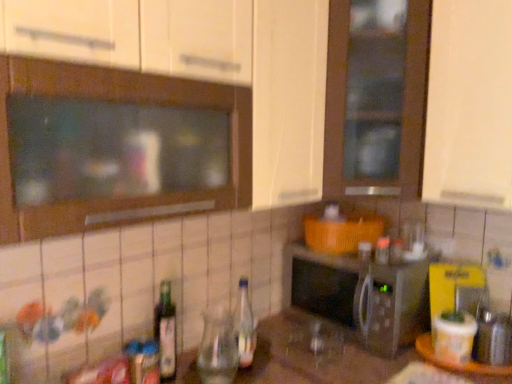
Question: Considering the relative sizes of clear glass bottle at center, the 2th bottle viewed from the left, and green glass bottle at lower left, arranged as the 1th bottle when viewed from the left, in the image provided, is clear glass bottle at center, the 2th bottle viewed from the left, taller than green glass bottle at lower left, arranged as the 1th bottle when viewed from the left,?

Choices:
 (A) yes
 (B) no

Answer: (B)

Question: Is clear glass bottle at center, the 2th bottle viewed from the left, smaller than green glass bottle at lower left, which is the second bottle from right to left?

Choices:
 (A) yes
 (B) no

Answer: (A)

Question: From a real-world perspective, does clear glass bottle at center, placed as the 1th bottle when sorted from right to left, sit lower than green glass bottle at lower left, which is the second bottle from right to left?

Choices:
 (A) no
 (B) yes

Answer: (A)

Question: Is clear glass bottle at center, placed as the 1th bottle when sorted from right to left, bigger than green glass bottle at lower left, which is the second bottle from right to left?

Choices:
 (A) no
 (B) yes

Answer: (A)

Question: Is clear glass bottle at center, placed as the 1th bottle when sorted from right to left, outside of green glass bottle at lower left, which is the second bottle from right to left?

Choices:
 (A) yes
 (B) no

Answer: (A)

Question: From a real-world perspective, is green glass bottle at lower left, which is the second bottle from right to left, positioned above or below silver metallic microwave at center?

Choices:
 (A) below
 (B) above

Answer: (B)

Question: In terms of size, does green glass bottle at lower left, arranged as the 1th bottle when viewed from the left, appear bigger or smaller than silver metallic microwave at center?

Choices:
 (A) big
 (B) small

Answer: (B)

Question: In the image, is green glass bottle at lower left, which is the second bottle from right to left, positioned in front of or behind silver metallic microwave at center?

Choices:
 (A) front
 (B) behind

Answer: (A)

Question: Visually, is green glass bottle at lower left, arranged as the 1th bottle when viewed from the left, positioned to the left or to the right of silver metallic microwave at center?

Choices:
 (A) right
 (B) left

Answer: (B)

Question: Is silver metallic microwave at center situated inside clear glass bottle at center, the 2th bottle viewed from the left, or outside?

Choices:
 (A) inside
 (B) outside

Answer: (B)

Question: In terms of width, does silver metallic microwave at center look wider or thinner when compared to clear glass bottle at center, the 2th bottle viewed from the left?

Choices:
 (A) thin
 (B) wide

Answer: (B)

Question: Relative to clear glass bottle at center, placed as the 1th bottle when sorted from right to left, is silver metallic microwave at center in front or behind?

Choices:
 (A) behind
 (B) front

Answer: (A)

Question: In terms of size, does silver metallic microwave at center appear bigger or smaller than clear glass bottle at center, the 2th bottle viewed from the left?

Choices:
 (A) big
 (B) small

Answer: (A)

Question: From a real-world perspective, is green glass bottle at lower left, which is the second bottle from right to left, physically located above or below clear glass bottle at center, the 2th bottle viewed from the left?

Choices:
 (A) below
 (B) above

Answer: (A)

Question: Considering the positions of point (156, 306) and point (240, 326), is point (156, 306) closer or farther from the camera than point (240, 326)?

Choices:
 (A) closer
 (B) farther

Answer: (A)